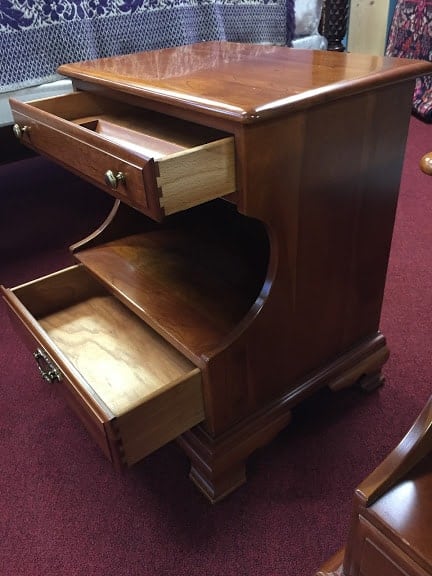
Where is `handle`? The image size is (432, 576). handle is located at coordinates (47, 378).